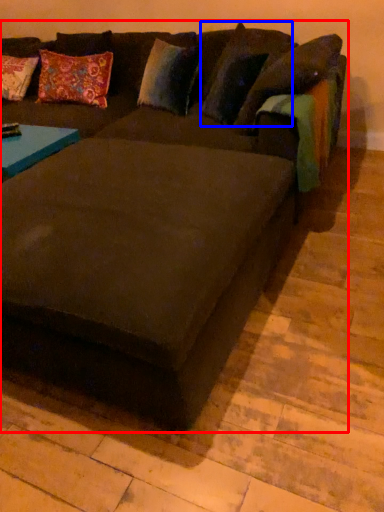
Question: Which point is closer to the camera, studio couch (highlighted by a red box) or pillow (highlighted by a blue box)?

Choices:
 (A) studio couch
 (B) pillow

Answer: (A)